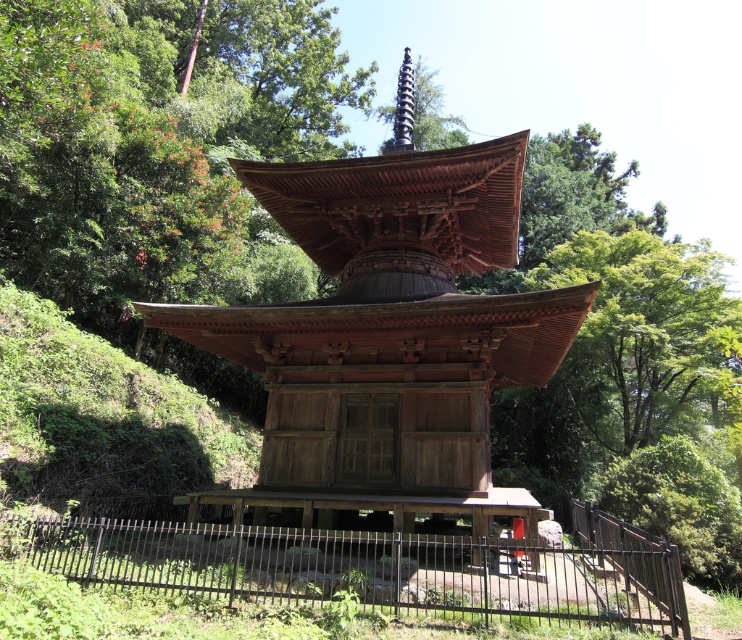
You are a visitor standing in front of the wooden pagoda at center and the black wrought iron fence at lower center. Which object is wider?

The wooden pagoda at center has a lesser width compared to the black wrought iron fence at lower center, so the black wrought iron fence at lower center is wider.

You are a landscape architect designing a new garden around the wooden pagoda at center and the black wrought iron fence at lower center. Which structure takes up more area in the garden?

The black wrought iron fence at lower center occupies more space than the wooden pagoda at center.

You are a visitor standing at the entrance of the pagoda area. You want to take a photo of the wooden pagoda at center without any obstructions. Is the black wrought iron fence at lower center blocking your view of the pagoda?

The wooden pagoda at center is positioned under the black wrought iron fence at lower center, so the fence is blocking the view of the pagoda. To take an unobstructed photo, you need to move to a position where the fence is not in front of the pagoda.